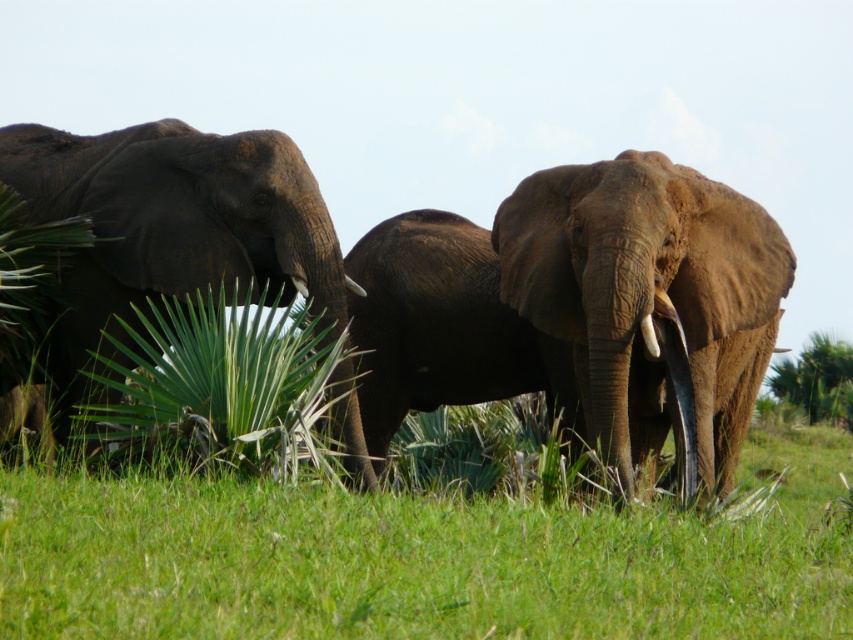
In the scene shown: You are standing in the natural setting where the elephants are grazing. You see the green leafy tree at center and the white ivory tusk at center. Which object is located to the right when facing the scene?

The green leafy tree at center is to the right of the white ivory tusk at center.

Looking at this image, you are a photographer trying to capture a closeup of the white ivory tusk at center without including the green leafy tree at center in the frame. Given their relative sizes, is this possible?

The green leafy tree at center is wider than the white ivory tusk at center. Since the tree is larger in width, it might block the tusk if positioned between them. However, if the tusk is positioned to one side of the tree, you could frame it without the tree by adjusting your angle. But based on their sizes alone, the tree being wider complicates excluding it without moving closer or using a narrower lens.

You are a wildlife photographer observing the elephants in the scene. You need to capture a photo where both the dark brown elephant at left and the white glossy tusk at center are visible. Based on their positions, which direction should you move to ensure both are in the frame?

The dark brown elephant at left is to the left of the white glossy tusk at center. To include both in the frame, you should move to the left so that you can capture the dark brown elephant at left and the white glossy tusk at center within the camera view.